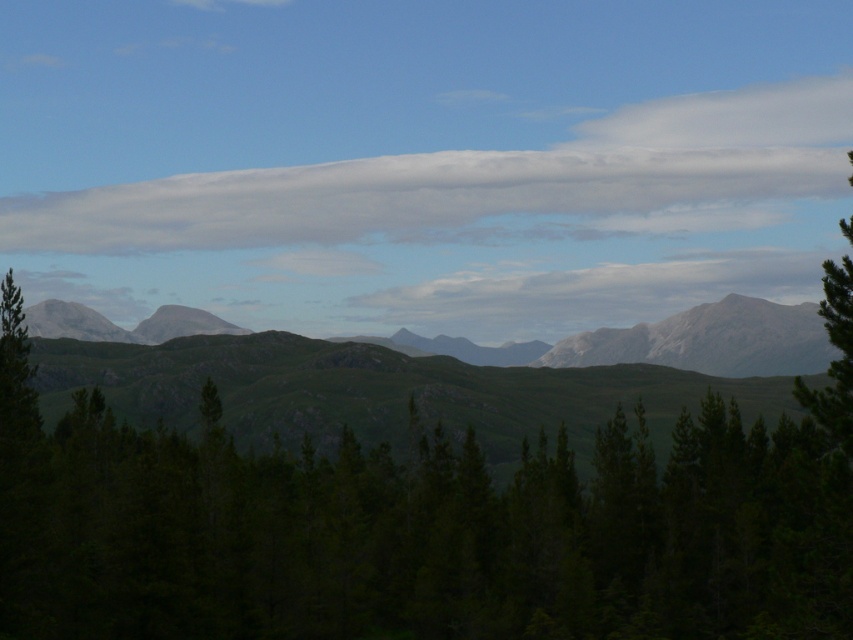
Question: Among these points, which one is farthest from the camera?

Choices:
 (A) (299, 196)
 (B) (798, 305)

Answer: (A)

Question: Which object is positioned closest to the white fluffy cloud at upper center?

Choices:
 (A) gray rock mountain range at center
 (B) gray rocky mountains at center

Answer: (B)

Question: Is white fluffy cloud at upper center smaller than gray rocky mountains at center?

Choices:
 (A) yes
 (B) no

Answer: (A)

Question: Does white fluffy cloud at upper center appear under gray rock mountain range at center?

Choices:
 (A) no
 (B) yes

Answer: (A)

Question: Estimate the real-world distances between objects in this image. Which object is farther from the white fluffy cloud at upper center?

Choices:
 (A) gray rocky mountains at center
 (B) gray rock mountain range at center

Answer: (B)

Question: Does white fluffy cloud at upper center have a greater width compared to gray rocky mountains at center?

Choices:
 (A) no
 (B) yes

Answer: (B)